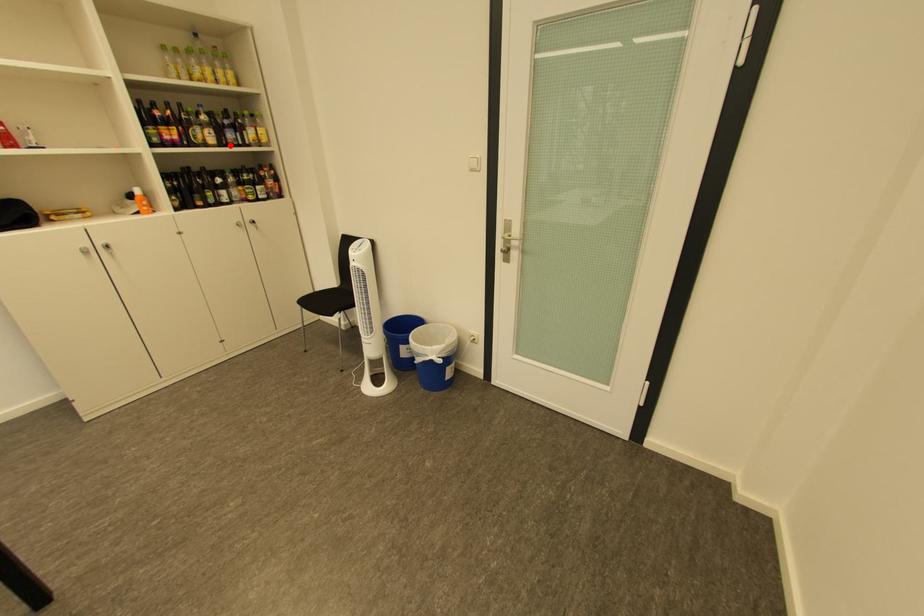
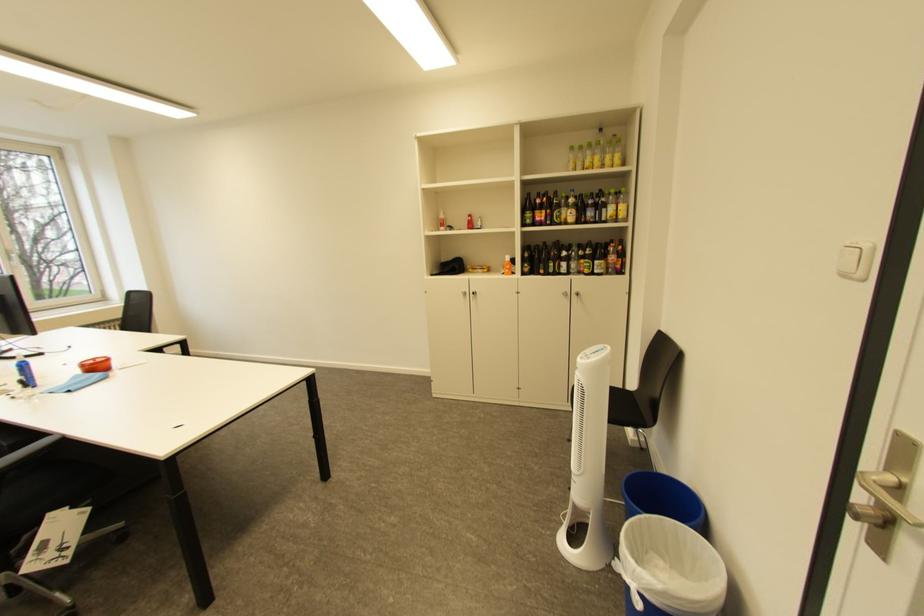
Locate, in the second image, the point that corresponds to the highlighted location in the first image.

(587, 224)